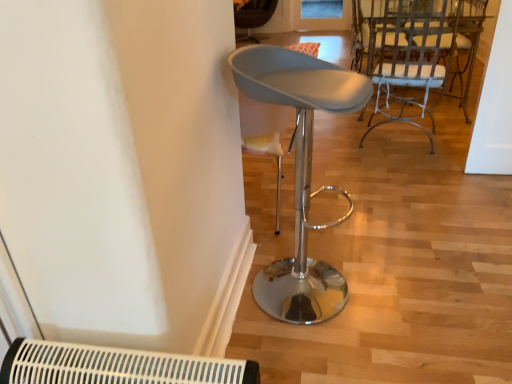
Question: Can you confirm if matte gray stool at center, arranged as the 1th chair when ordered from the bottom, is smaller than white painted metal chair at upper right, which is the 3th chair in left-to-right order?

Choices:
 (A) no
 (B) yes

Answer: (B)

Question: Is matte gray stool at center, the third chair viewed from the back, far away from white painted metal chair at upper right, the 1th chair from the right?

Choices:
 (A) no
 (B) yes

Answer: (B)

Question: Would you say white painted metal chair at upper right, the 1th chair from the right, is part of matte gray stool at center, marked as the 2th chair in a left-to-right arrangement,'s contents?

Choices:
 (A) no
 (B) yes

Answer: (A)

Question: Is matte gray stool at center, which appears as the 2th chair when viewed from the right, facing away from white painted metal chair at upper right, the second chair from the back?

Choices:
 (A) yes
 (B) no

Answer: (B)

Question: Is matte gray stool at center, which ranks as the third chair in top-to-bottom order, next to white painted metal chair at upper right, the 2th chair viewed from the front, and touching it?

Choices:
 (A) yes
 (B) no

Answer: (B)

Question: From a real-world perspective, is matte gray stool at center, the 1th chair in the front-to-back sequence, positioned over white painted metal chair at upper right, the 2th chair viewed from the front, based on gravity?

Choices:
 (A) no
 (B) yes

Answer: (B)

Question: Is matte gray stool at center, which appears as the 2th chair when viewed from the right, oriented away from velvet brown chair at center, the third chair in the bottom-to-top sequence?

Choices:
 (A) no
 (B) yes

Answer: (A)

Question: From the image's perspective, is matte gray stool at center, the third chair viewed from the back, beneath velvet brown chair at center, the 1th chair viewed from the top?

Choices:
 (A) yes
 (B) no

Answer: (A)

Question: Is matte gray stool at center, which appears as the 2th chair when viewed from the right, to the right of velvet brown chair at center, the first chair when ordered from back to front, from the viewer's perspective?

Choices:
 (A) no
 (B) yes

Answer: (B)

Question: Would you say matte gray stool at center, arranged as the 1th chair when ordered from the bottom, is outside velvet brown chair at center, marked as the third chair in a front-to-back arrangement?

Choices:
 (A) no
 (B) yes

Answer: (B)

Question: Is matte gray stool at center, marked as the 2th chair in a left-to-right arrangement, behind velvet brown chair at center, the 1th chair viewed from the top?

Choices:
 (A) yes
 (B) no

Answer: (B)

Question: From a real-world perspective, is matte gray stool at center, marked as the 2th chair in a left-to-right arrangement, over velvet brown chair at center, the 1th chair viewed from the top?

Choices:
 (A) no
 (B) yes

Answer: (B)

Question: Is white painted metal chair at upper right, which is the 3th chair in left-to-right order, shorter than matte gray stool at center, which appears as the 2th chair when viewed from the right?

Choices:
 (A) no
 (B) yes

Answer: (B)